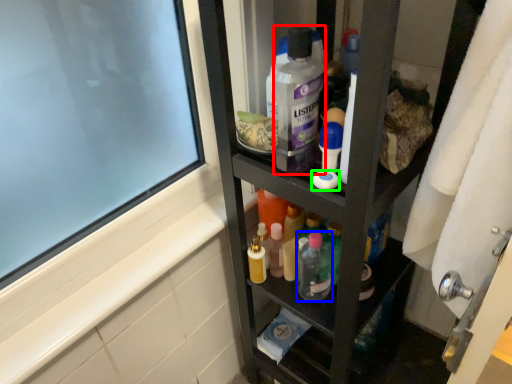
Question: Based on their relative distances, which object is nearer to cleaning product (highlighted by a red box)? Choose from toiletry (highlighted by a blue box) and soap (highlighted by a green box).

Choices:
 (A) toiletry
 (B) soap

Answer: (B)